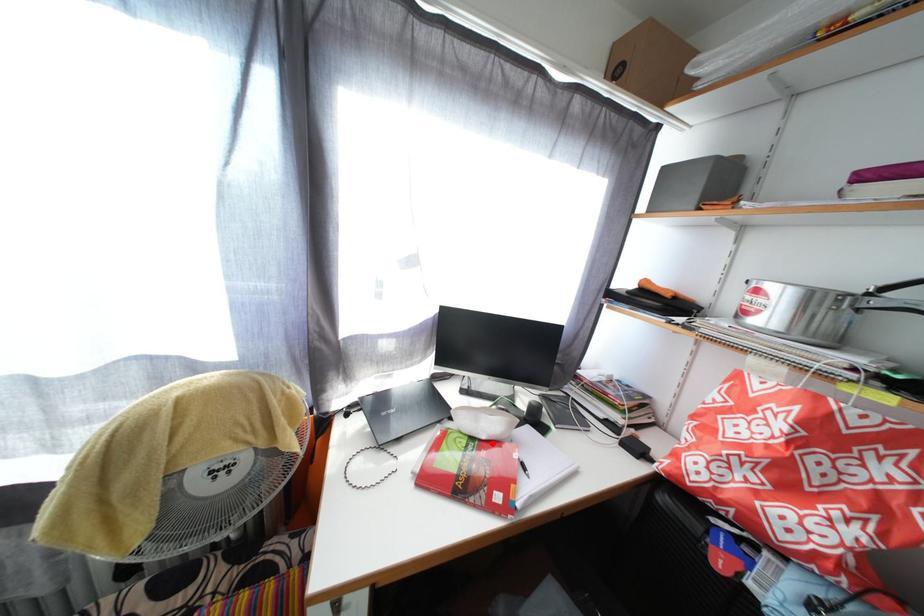
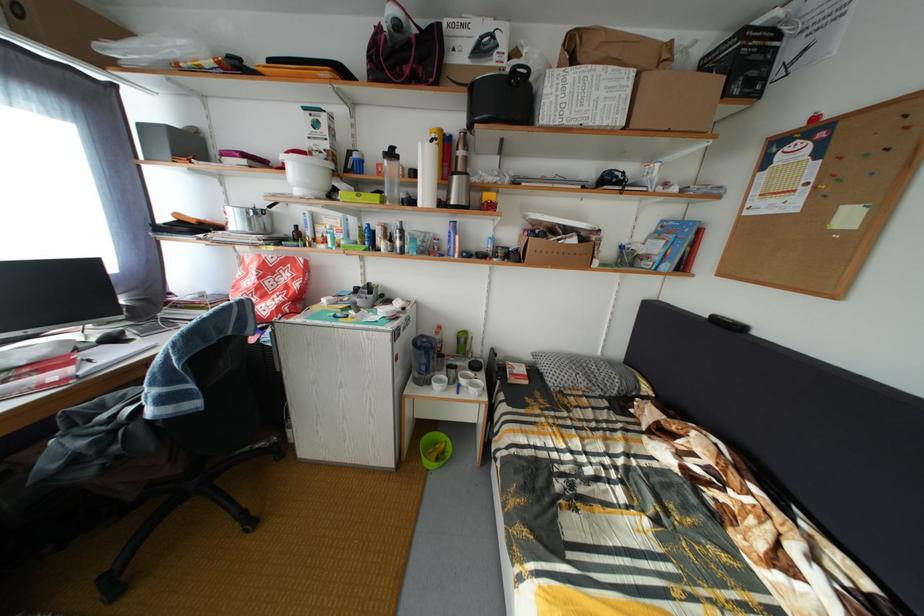
Locate, in the second image, the point that corresponds to the highlighted location in the first image.

(31, 370)